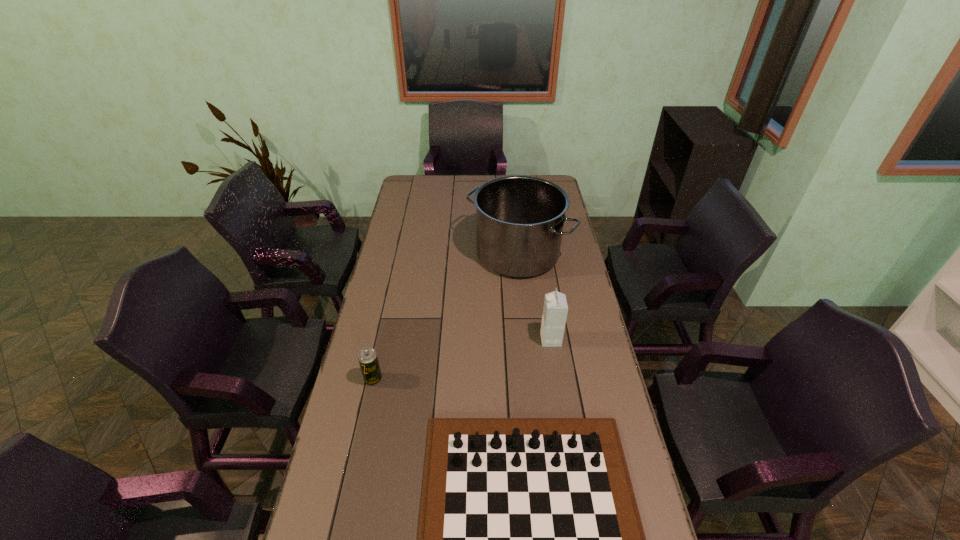
Locate an element on the screen. This screenshot has width=960, height=540. saucepan is located at coordinates (519, 219).

Locate an element on the screen. The height and width of the screenshot is (540, 960). the tallest object is located at coordinates click(x=519, y=219).

This screenshot has height=540, width=960. I want to click on the third nearest object, so coord(555,309).

This screenshot has width=960, height=540. I want to click on carton, so click(555, 309).

Find the location of a particular element. the second shortest object is located at coordinates 367,357.

The height and width of the screenshot is (540, 960). I want to click on beer can, so click(x=367, y=357).

What are the coordinates of `vacant space located 0.390m on the front of the farthest object` in the screenshot? It's located at (529, 361).

Find the location of `free space located 0.150m on the front label of the second tallest object`. free space located 0.150m on the front label of the second tallest object is located at coordinates (497, 340).

Find the location of a particular element. Image resolution: width=960 pixels, height=540 pixels. vacant area situated 0.190m on the front label of the second tallest object is located at coordinates (486, 340).

Locate an element on the screen. blank area located 0.320m on the front label of the second tallest object is located at coordinates (448, 340).